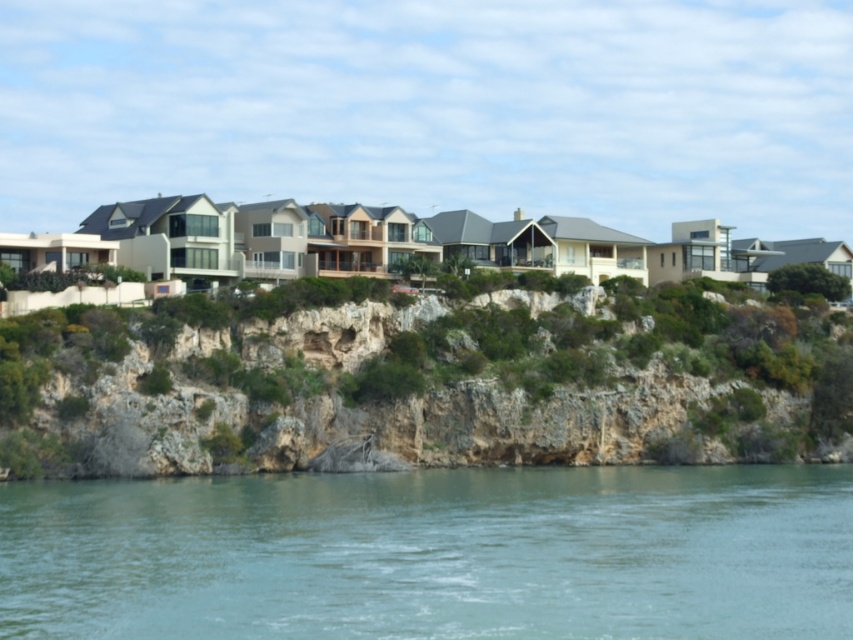
Can you confirm if clear water at lower center is taller than green rocky cliff at center?

A: No, clear water at lower center is not taller than green rocky cliff at center.

Is clear water at lower center to the left of green rocky cliff at center from the viewer's perspective?

Yes, clear water at lower center is to the left of green rocky cliff at center.

At what (x,y) coordinates should I click in order to perform the action: click on clear water at lower center. Please return your answer as a coordinate pair (x, y). Looking at the image, I should click on (433, 554).